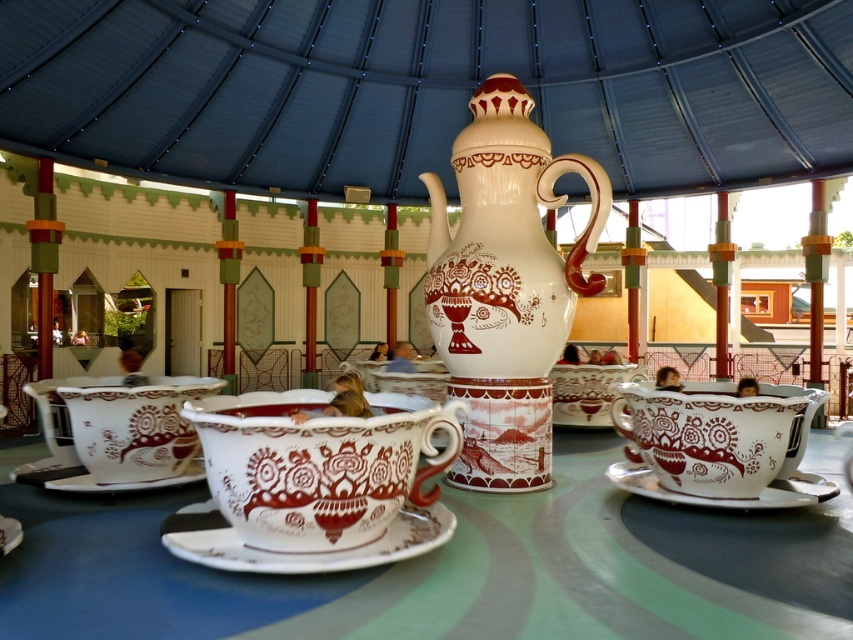
Question: Is white ceramic table at center positioned behind matte ceramic teapot at center?

Choices:
 (A) yes
 (B) no

Answer: (B)

Question: Is matte ceramic teapot at center smaller than brown matte teacup at center?

Choices:
 (A) no
 (B) yes

Answer: (A)

Question: Which point is closer to the camera taking this photo?

Choices:
 (A) (538, 132)
 (B) (634, 481)

Answer: (B)

Question: Based on their relative distances, which object is nearer to the white ceramic saucer at lower right?

Choices:
 (A) white glossy teacup at lower right
 (B) brown matte teacup at center
 (C) white ceramic saucer at center

Answer: (A)

Question: Does white ceramic table at center appear under matte porcelain teacup at lower left?

Choices:
 (A) yes
 (B) no

Answer: (A)

Question: Which point is farther from the camera taking this photo?

Choices:
 (A) (10, 536)
 (B) (821, 595)
 (C) (131, 488)
 (D) (320, 496)

Answer: (C)